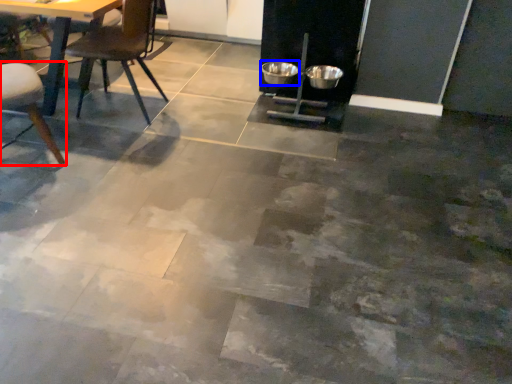
Question: Which of the following is the farthest to the observer, chair (highlighted by a red box) or bowl (highlighted by a blue box)?

Choices:
 (A) chair
 (B) bowl

Answer: (B)